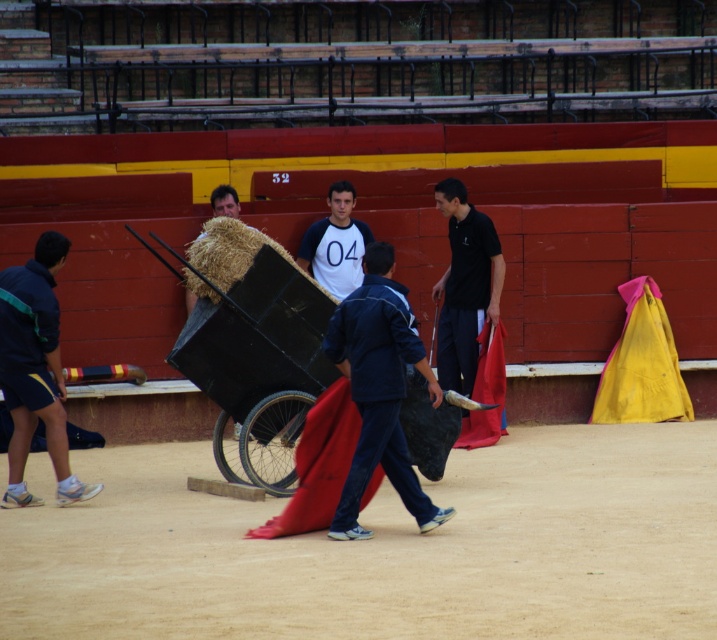
You are a photographer standing in the arena. You see the blue fabric at center and the black smooth shirt at center. Which object is positioned more to the left side of the arena?

The blue fabric at center is positioned to the left of the black smooth shirt at center, so the blue fabric at center is more to the left.

You are standing at the center of the arena and see a blue fabric at center. Where is the point at coordinates [379,388] located?

The point at coordinates [379,388] is located on the blue fabric at center.